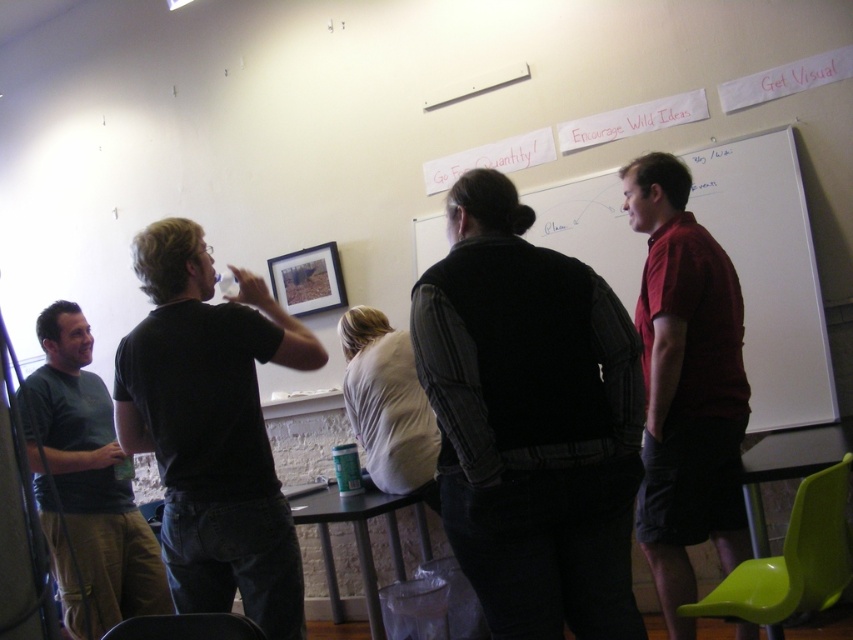
Question: Which point appears closest to the camera in this image?

Choices:
 (A) (86, 326)
 (B) (498, 445)
 (C) (219, 344)

Answer: (B)

Question: Does matte red shirt at right have a lesser width compared to whiteboard at center?

Choices:
 (A) no
 (B) yes

Answer: (B)

Question: Considering the real-world distances, which object is closest to the black matte t-shirt at left?

Choices:
 (A) dark gray vest at center
 (B) wooden frame at upper center
 (C) whiteboard at center
 (D) dark green t-shirt at left

Answer: (A)

Question: Where is whiteboard at center located in relation to dark green t-shirt at left in the image?

Choices:
 (A) right
 (B) left

Answer: (A)

Question: Is whiteboard at center to the right of wooden frame at upper center from the viewer's perspective?

Choices:
 (A) no
 (B) yes

Answer: (B)

Question: Considering the real-world distances, which object is farthest from the matte red shirt at right?

Choices:
 (A) dark gray vest at center
 (B) black matte t-shirt at left
 (C) dark green t-shirt at left
 (D) wooden frame at upper center

Answer: (D)